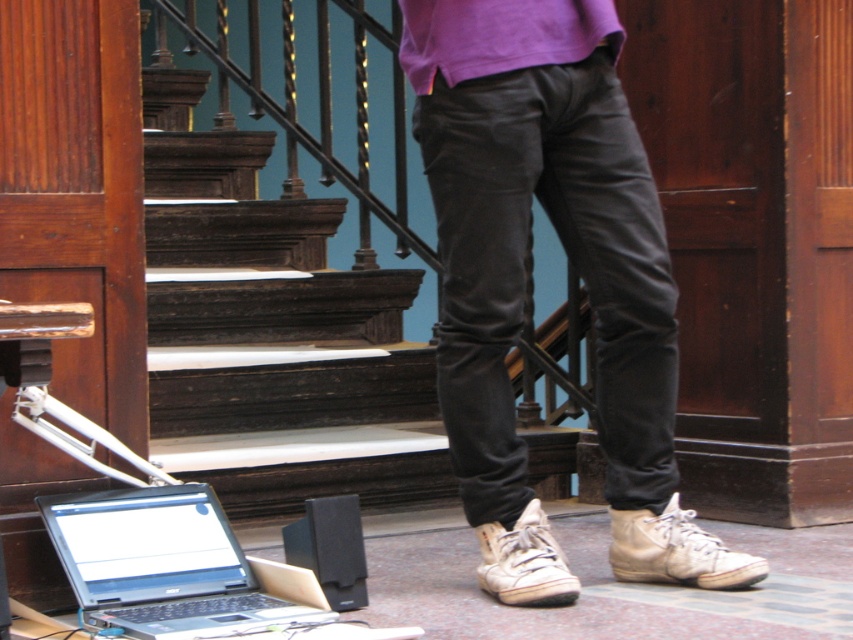
Question: Does dark wood stairs at center appear on the left side of purple cotton sweatshirt at center?

Choices:
 (A) yes
 (B) no

Answer: (A)

Question: Is dark wood stairs at center to the left of purple cotton sweatshirt at center from the viewer's perspective?

Choices:
 (A) no
 (B) yes

Answer: (B)

Question: Which object appears closest to the camera in this image?

Choices:
 (A) dark wood stairs at center
 (B) matte black pants at center
 (C) silver metallic laptop at lower left

Answer: (C)

Question: Which of the following is the farthest from the observer?

Choices:
 (A) matte black pants at center
 (B) purple cotton sweatshirt at center
 (C) silver metallic laptop at lower left
 (D) dark wood stairs at center

Answer: (D)

Question: Which object is positioned farthest from the silver metallic laptop at lower left?

Choices:
 (A) dark wood stairs at center
 (B) purple cotton sweatshirt at center

Answer: (B)

Question: Can you confirm if dark wood stairs at center is positioned above silver metallic laptop at lower left?

Choices:
 (A) yes
 (B) no

Answer: (A)